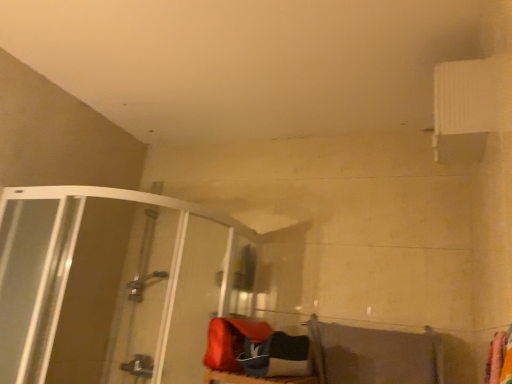
What are the coordinates of `transparent glass shower door at left` in the screenshot? It's located at (108, 285).

The width and height of the screenshot is (512, 384). What do you see at coordinates (108, 285) in the screenshot?
I see `transparent glass shower door at left` at bounding box center [108, 285].

This screenshot has height=384, width=512. I want to click on gray fabric beach towel at lower right, so click(x=374, y=355).

This screenshot has height=384, width=512. What do you see at coordinates (374, 355) in the screenshot?
I see `gray fabric beach towel at lower right` at bounding box center [374, 355].

Where is `transparent glass shower door at left`? transparent glass shower door at left is located at coordinates (108, 285).

Visually, is gray fabric beach towel at lower right positioned to the left or to the right of transparent glass shower door at left?

Clearly, gray fabric beach towel at lower right is on the right of transparent glass shower door at left in the image.

Considering their positions, is gray fabric beach towel at lower right located in front of or behind transparent glass shower door at left?

In the image, gray fabric beach towel at lower right appears behind transparent glass shower door at left.

Does point (375, 356) appear closer or farther from the camera than point (126, 293)?

Clearly, point (375, 356) is closer to the camera than point (126, 293).

From the image's perspective, is gray fabric beach towel at lower right above or below transparent glass shower door at left?

Clearly, from the image's perspective, gray fabric beach towel at lower right is below transparent glass shower door at left.

From a real-world perspective, is gray fabric beach towel at lower right positioned over transparent glass shower door at left based on gravity?

No, from a real-world perspective, gray fabric beach towel at lower right is not over transparent glass shower door at left

Between gray fabric beach towel at lower right and transparent glass shower door at left, which one has larger width?

With larger width is transparent glass shower door at left.

Can you confirm if gray fabric beach towel at lower right is shorter than transparent glass shower door at left?

Yes.

Does gray fabric beach towel at lower right have a smaller size compared to transparent glass shower door at left?

Indeed, gray fabric beach towel at lower right has a smaller size compared to transparent glass shower door at left.

Is gray fabric beach towel at lower right spatially inside transparent glass shower door at left, or outside of it?

gray fabric beach towel at lower right lies outside transparent glass shower door at left.

Does gray fabric beach towel at lower right touch transparent glass shower door at left?

No, gray fabric beach towel at lower right is not touching transparent glass shower door at left.

Is gray fabric beach towel at lower right facing away from transparent glass shower door at left?

No, gray fabric beach towel at lower right is not facing away from transparent glass shower door at left.

In the scene shown: What's the angular difference between gray fabric beach towel at lower right and transparent glass shower door at left's facing directions?

0.496 degrees.

Measure the distance from gray fabric beach towel at lower right to transparent glass shower door at left.

A distance of 36.60 inches exists between gray fabric beach towel at lower right and transparent glass shower door at left.

Identify the location of beach towel that is on the right side of transparent glass shower door at left. Image resolution: width=512 pixels, height=384 pixels. (374, 355).

Would you say transparent glass shower door at left is to the left or to the right of gray fabric beach towel at lower right in the picture?

transparent glass shower door at left is positioned on gray fabric beach towel at lower right's left side.

Is transparent glass shower door at left positioned behind gray fabric beach towel at lower right?

That is False.

Which is behind, point (159, 293) or point (399, 370)?

The point (159, 293) is farther.

From the image's perspective, is transparent glass shower door at left beneath gray fabric beach towel at lower right?

No, from the image's perspective, transparent glass shower door at left is not beneath gray fabric beach towel at lower right.

From a real-world perspective, who is located higher, transparent glass shower door at left or gray fabric beach towel at lower right?

transparent glass shower door at left.

Between transparent glass shower door at left and gray fabric beach towel at lower right, which one has larger width?

Wider between the two is transparent glass shower door at left.

Who is shorter, transparent glass shower door at left or gray fabric beach towel at lower right?

Standing shorter between the two is gray fabric beach towel at lower right.

Which of these two, transparent glass shower door at left or gray fabric beach towel at lower right, is bigger?

transparent glass shower door at left is bigger.

Is gray fabric beach towel at lower right inside transparent glass shower door at left?

No.

Is there a large distance between transparent glass shower door at left and gray fabric beach towel at lower right?

No, transparent glass shower door at left is not far from gray fabric beach towel at lower right.

Is transparent glass shower door at left facing towards gray fabric beach towel at lower right?

No.

How many degrees apart are the facing directions of transparent glass shower door at left and gray fabric beach towel at lower right?

The facing directions of transparent glass shower door at left and gray fabric beach towel at lower right are 0.496 degrees apart.

In order to click on shower door in front of the gray fabric beach towel at lower right in this screenshot , I will do `click(108, 285)`.

Locate an element on the screen. beach towel that appears below the transparent glass shower door at left (from the image's perspective) is located at coordinates (374, 355).

Locate an element on the screen. This screenshot has height=384, width=512. beach towel on the right of transparent glass shower door at left is located at coordinates (374, 355).